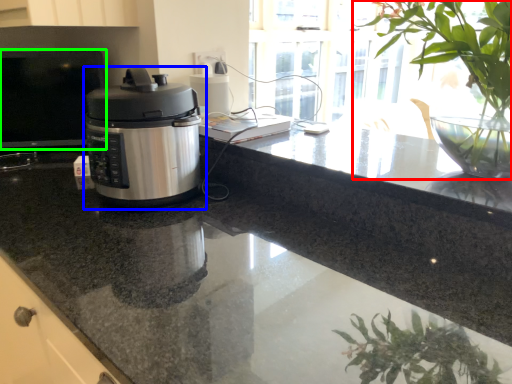
Question: Which object is the closest to the houseplant (highlighted by a red box)? Choose among these: home appliance (highlighted by a blue box) or desktop (highlighted by a green box).

Choices:
 (A) home appliance
 (B) desktop

Answer: (A)